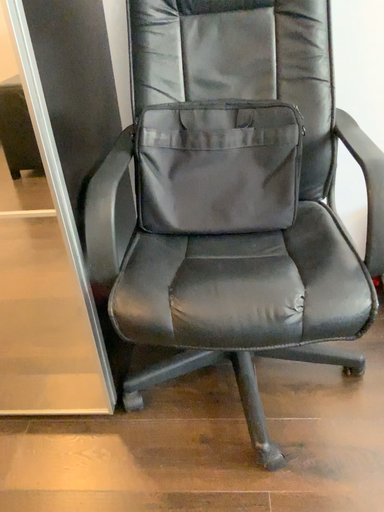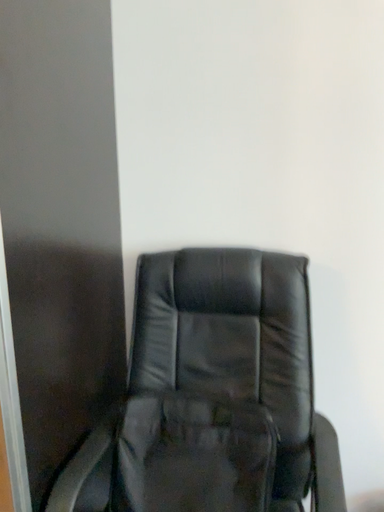
Question: Which way did the camera rotate in the video?

Choices:
 (A) rotated left
 (B) rotated right

Answer: (A)